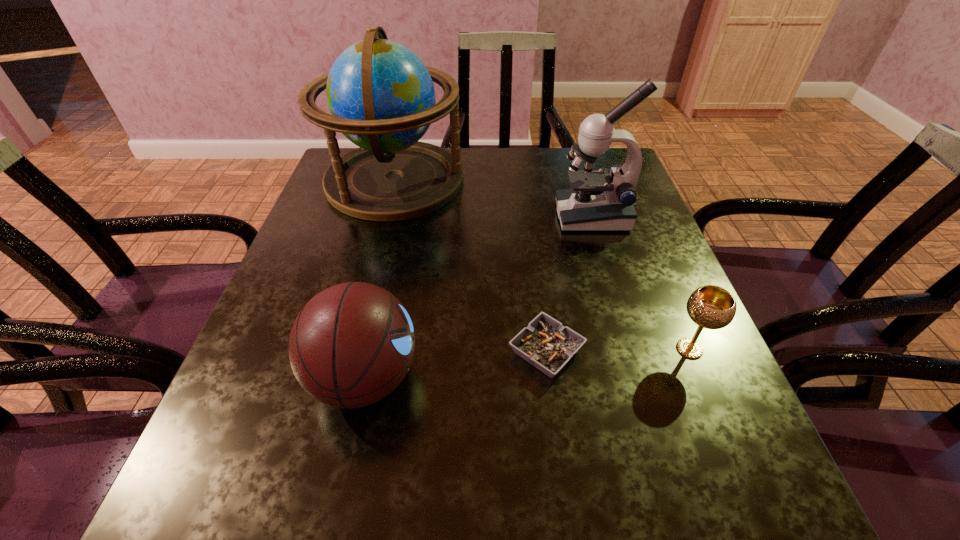
Where is `unoccupied area between the fourth tallest object and the ashtray`? The height and width of the screenshot is (540, 960). unoccupied area between the fourth tallest object and the ashtray is located at coordinates point(618,350).

Find the location of a particular element. This screenshot has height=540, width=960. free space between the fourth shortest object and the ashtray is located at coordinates (569, 284).

Identify the location of vacant area that lies between the chalice and the third object from left to right. The width and height of the screenshot is (960, 540). (618, 350).

What are the coordinates of `vacant space in between the globe and the basketball` in the screenshot? It's located at (380, 279).

This screenshot has height=540, width=960. Find the location of `vacant space that is in between the ashtray and the microscope`. vacant space that is in between the ashtray and the microscope is located at coordinates (569, 284).

This screenshot has width=960, height=540. In order to click on vacant space in between the chalice and the shortest object in this screenshot , I will do `click(618, 350)`.

The width and height of the screenshot is (960, 540). Identify the location of free space between the chalice and the globe. (542, 265).

Locate an element on the screen. The width and height of the screenshot is (960, 540). unoccupied position between the globe and the ashtray is located at coordinates (470, 266).

The height and width of the screenshot is (540, 960). I want to click on empty space between the basketball and the globe, so click(380, 279).

The height and width of the screenshot is (540, 960). I want to click on free space between the basketball and the second tallest object, so click(479, 297).